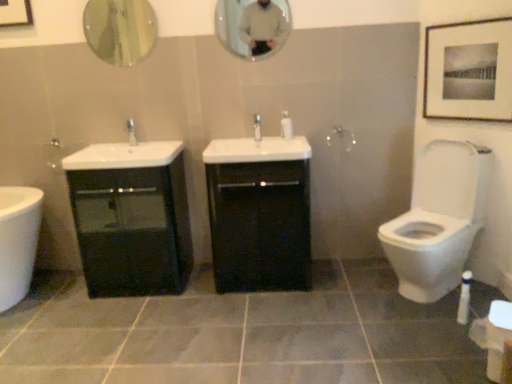
The height and width of the screenshot is (384, 512). Identify the location of vacant area that lies between white glossy toilet at right and white plastic toothbrush at lower right. (452, 308).